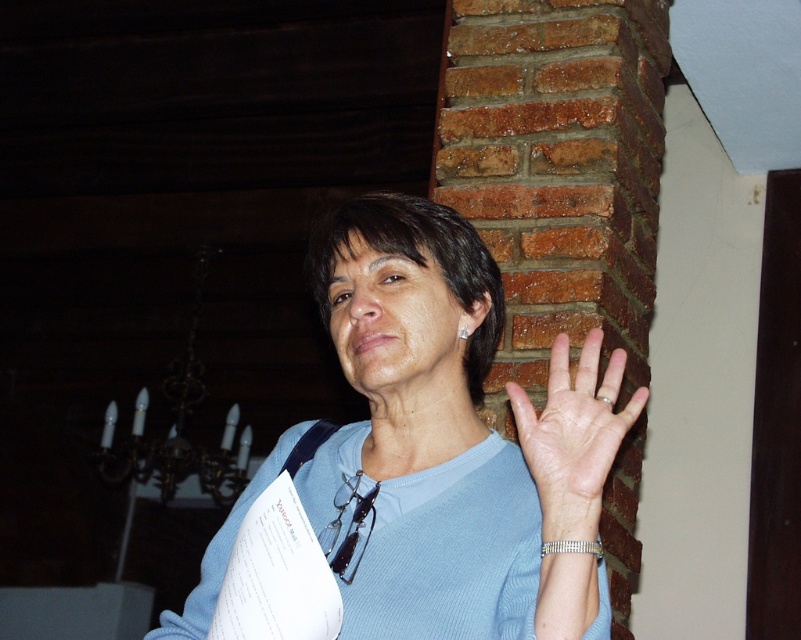
You are a photographer adjusting your camera settings. You notice the blue fabric shirt at center and the pale skin palm at center in the frame. Which object is positioned higher in the image?

The blue fabric shirt at center is above the pale skin palm at center, so the blue fabric shirt at center is positioned higher in the image.

You are a fashion designer observing the person in the image. You need to determine if the blue fabric shirt at center can be folded and placed into the pale skin palm at center. Based on their sizes, what is your conclusion?

The blue fabric shirt at center is larger in size than the pale skin palm at center, so it cannot be folded and placed into the palm.

Consider the image. You are an interior designer assessing the placement of a new decorative item. You notice the blue fabric shirt at center and the pale skin palm at center. Which object is positioned higher up in the scene?

The blue fabric shirt at center is much taller than the pale skin palm at center, so the blue fabric shirt at center is positioned higher up in the scene.